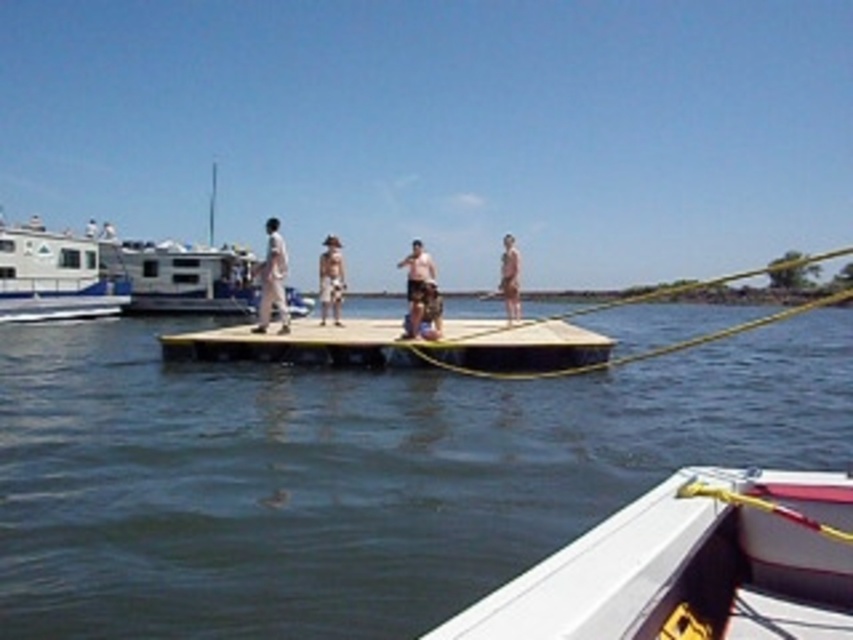
Can you confirm if white plastic boat at left is smaller than beige fabric hat at center?

Actually, white plastic boat at left might be larger than beige fabric hat at center.

Is point (78, 300) more distant than point (332, 300)?

Yes, it is behind point (332, 300).

Where is `white plastic boat at left`? The height and width of the screenshot is (640, 853). white plastic boat at left is located at coordinates (53, 276).

Who is more distant from viewer, (355, 380) or (408, 316)?

The point (408, 316) is more distant.

Between point (701, 456) and point (425, 310), which one is positioned behind?

The point (425, 310) is behind.

The image size is (853, 640). Identify the location of dark blue water at center. (352, 474).

In the scene shown: Who is taller, dark blue water at center or brown wooden dock at center?

dark blue water at center

Between dark blue water at center and brown wooden dock at center, which one appears on the right side from the viewer's perspective?

dark blue water at center is more to the right.

Which is behind, point (372, 580) or point (611, 339)?

The point (611, 339) is more distant.

Where is `dark blue water at center`? The image size is (853, 640). dark blue water at center is located at coordinates (352, 474).